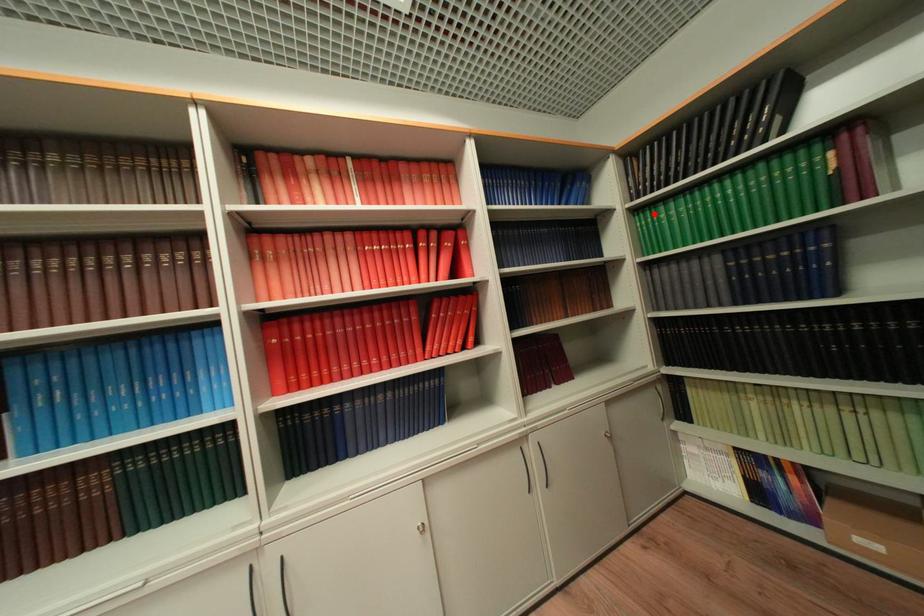
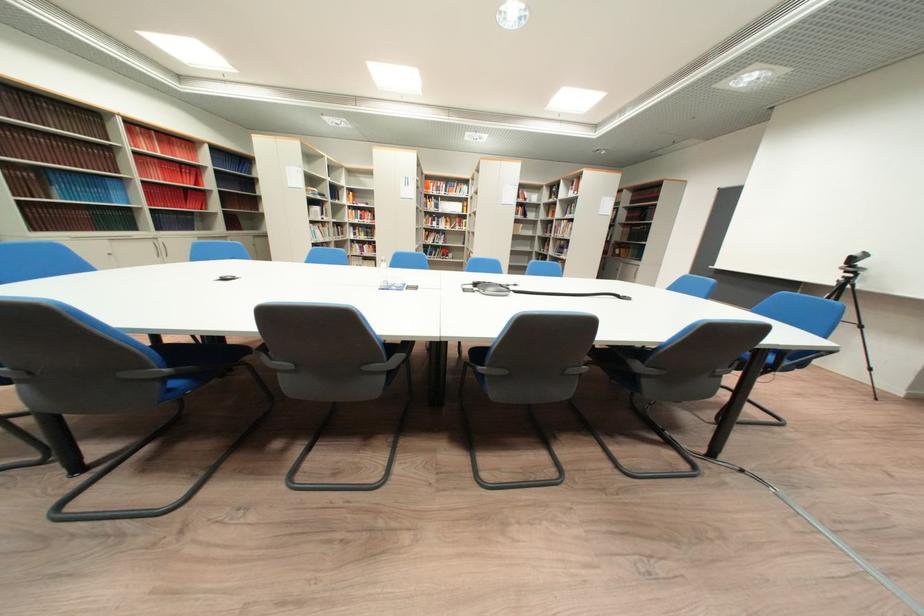
Question: I am providing you with two images of the same scene from different viewpoints. A red point is marked on the first image. Is the red point's position out of view in image 2?

Choices:
 (A) Yes
 (B) No

Answer: (A)